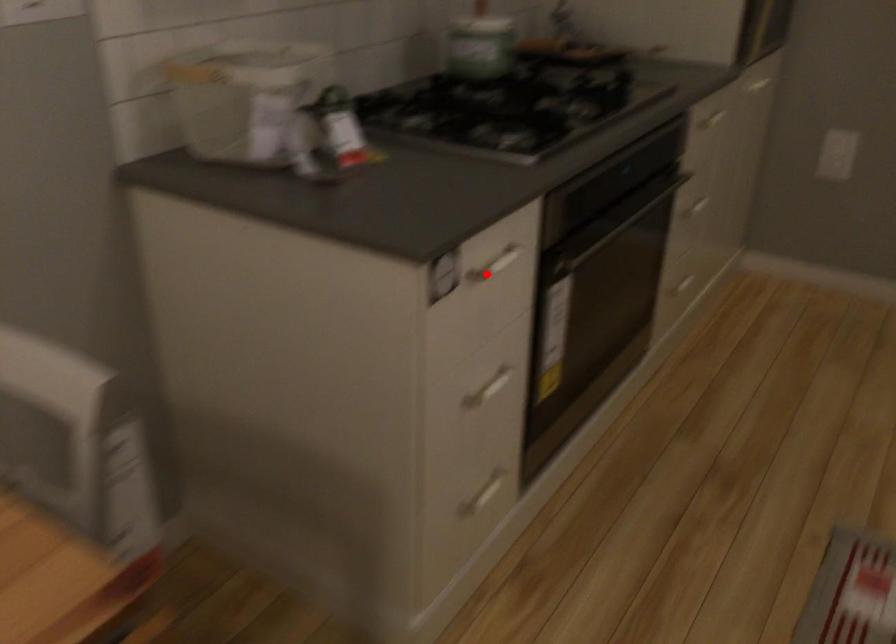
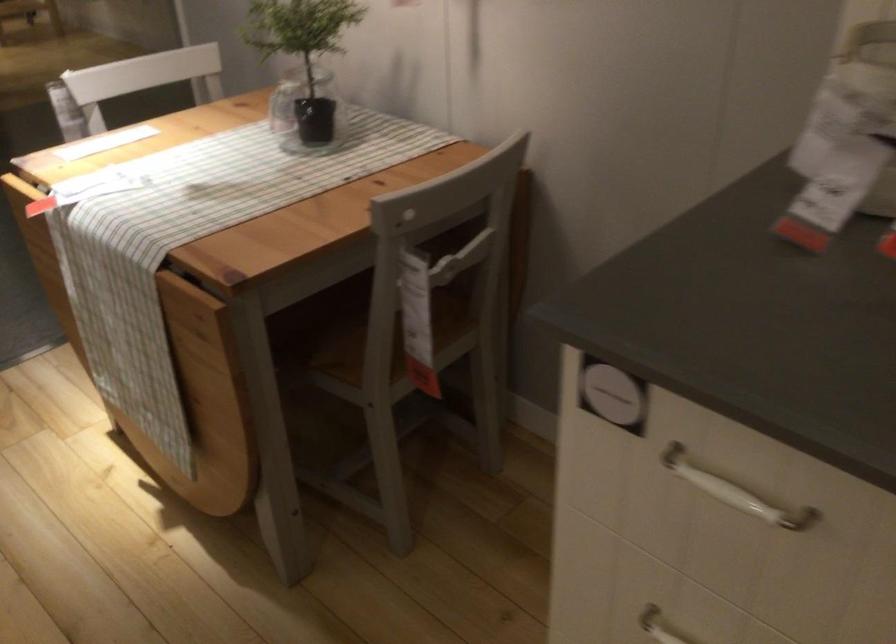
Question: A red point is marked in image1. In image2, is the corresponding 3D point closer to the camera or farther? Reply with the corresponding letter.

Choices:
 (A) The corresponding 3D point is closer.
 (B) The corresponding 3D point is farther.

Answer: (A)